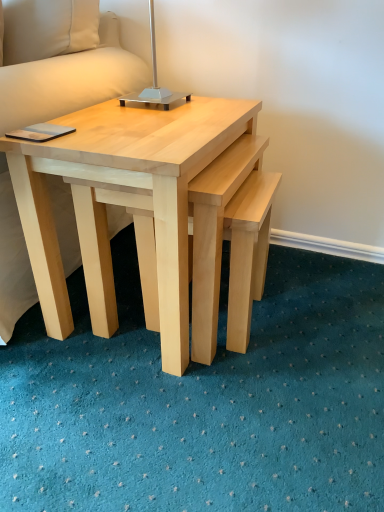
Question: Can you confirm if white fabric pillow at upper left is positioned to the right of natural wood coffee table at center?

Choices:
 (A) yes
 (B) no

Answer: (B)

Question: Does white fabric pillow at upper left have a larger size compared to natural wood coffee table at center?

Choices:
 (A) yes
 (B) no

Answer: (B)

Question: Is white fabric pillow at upper left further to the viewer compared to natural wood coffee table at center?

Choices:
 (A) yes
 (B) no

Answer: (A)

Question: Considering the relative sizes of white fabric pillow at upper left and natural wood coffee table at center in the image provided, is white fabric pillow at upper left taller than natural wood coffee table at center?

Choices:
 (A) no
 (B) yes

Answer: (A)

Question: Does white fabric pillow at upper left lie in front of natural wood coffee table at center?

Choices:
 (A) no
 (B) yes

Answer: (A)

Question: Is white fabric pillow at upper left surrounding natural wood coffee table at center?

Choices:
 (A) no
 (B) yes

Answer: (A)

Question: Does natural wood coffee table at center lie behind metallic silver table lamp at upper center?

Choices:
 (A) yes
 (B) no

Answer: (B)

Question: From the image's perspective, is natural wood coffee table at center on top of metallic silver table lamp at upper center?

Choices:
 (A) yes
 (B) no

Answer: (B)

Question: Is natural wood coffee table at center thinner than metallic silver table lamp at upper center?

Choices:
 (A) yes
 (B) no

Answer: (B)

Question: Is natural wood coffee table at center smaller than metallic silver table lamp at upper center?

Choices:
 (A) yes
 (B) no

Answer: (B)

Question: Can you confirm if natural wood coffee table at center is shorter than metallic silver table lamp at upper center?

Choices:
 (A) yes
 (B) no

Answer: (B)

Question: From a real-world perspective, is natural wood coffee table at center positioned over metallic silver table lamp at upper center based on gravity?

Choices:
 (A) yes
 (B) no

Answer: (B)

Question: Is metallic silver table lamp at upper center completely or partially outside of natural wood coffee table at center?

Choices:
 (A) no
 (B) yes

Answer: (B)